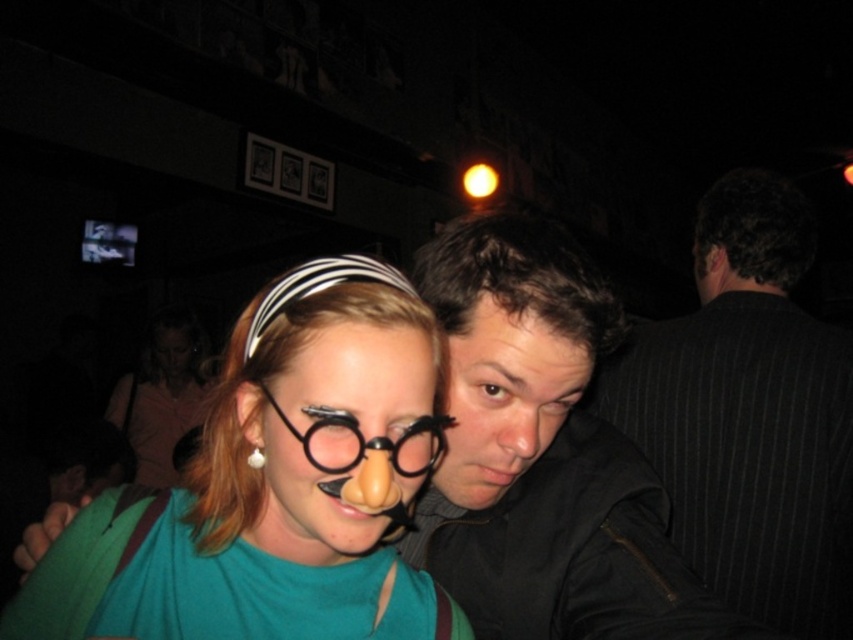
Question: Based on their relative distances, which object is farther from the gold metallic earring at lower left?

Choices:
 (A) smooth skin face at center
 (B) matte black glasses at center
 (C) dark pinstripe suit at right
 (D) dark gray jacket at center

Answer: (C)

Question: Among these objects, which one is farthest from the camera?

Choices:
 (A) dark pinstripe suit at right
 (B) matte pink shirt at center

Answer: (B)

Question: Which point appears closest to the camera in this image?

Choices:
 (A) (248, 371)
 (B) (358, 458)
 (C) (190, 336)

Answer: (B)

Question: Does dark pinstripe suit at right have a smaller size compared to matte black glasses at center?

Choices:
 (A) yes
 (B) no

Answer: (B)

Question: Can you confirm if dark gray jacket at center is wider than gold metallic earring at lower left?

Choices:
 (A) no
 (B) yes

Answer: (B)

Question: Does smooth skin face at center appear under gold metallic earring at lower left?

Choices:
 (A) yes
 (B) no

Answer: (B)